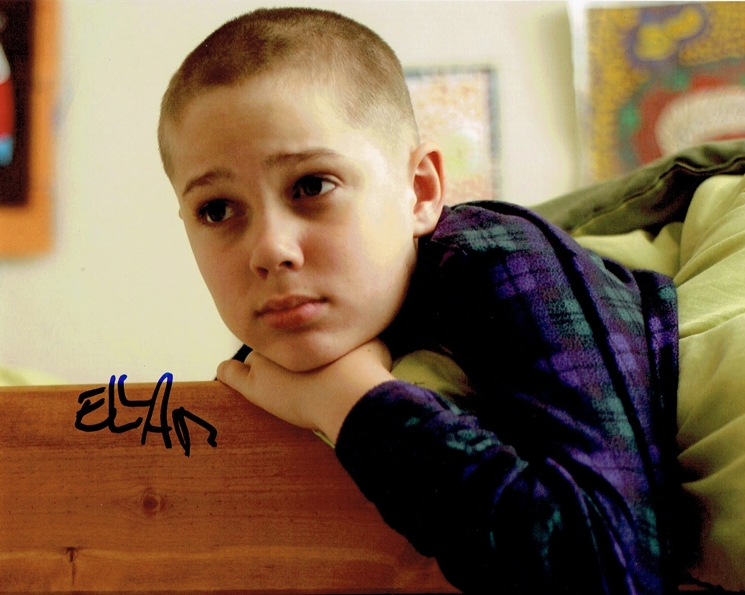
The height and width of the screenshot is (595, 745). Find the location of `picture`. picture is located at coordinates (469, 131).